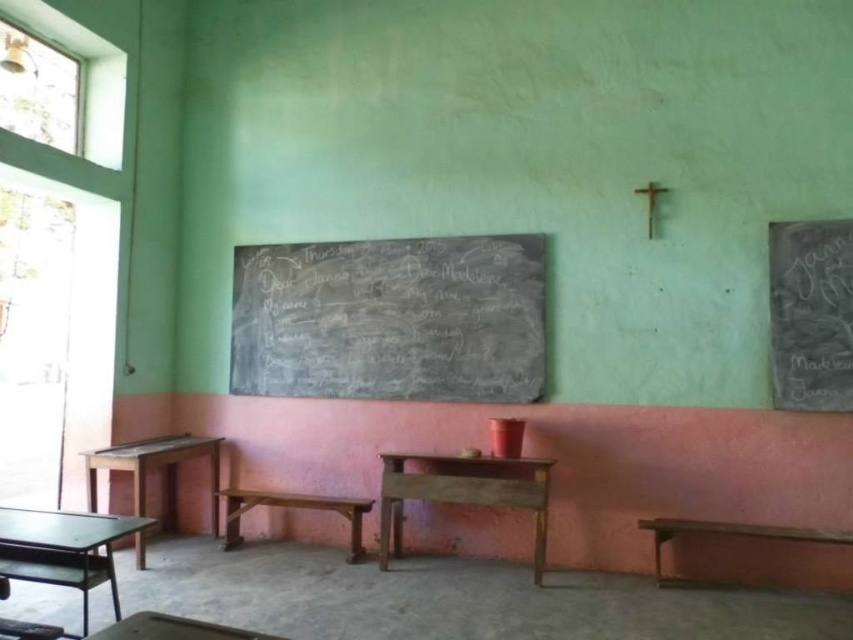
Question: Which point is farther to the camera?

Choices:
 (A) wooden table at lower center
 (B) wooden desk at left

Answer: (B)

Question: Among these points, which one is nearest to the camera?

Choices:
 (A) (163, 634)
 (B) (430, 460)
 (C) (357, 499)

Answer: (A)

Question: Can you confirm if wooden table at lower left is smaller than wooden stool at center?

Choices:
 (A) yes
 (B) no

Answer: (B)

Question: Which point is farther to the camera?

Choices:
 (A) (276, 499)
 (B) (434, 460)
 (C) (88, 518)

Answer: (A)

Question: Can you confirm if wooden table at center is positioned to the left of wooden stool at center?

Choices:
 (A) yes
 (B) no

Answer: (B)

Question: Can you confirm if wooden desk at left is smaller than wooden table at lower center?

Choices:
 (A) no
 (B) yes

Answer: (A)